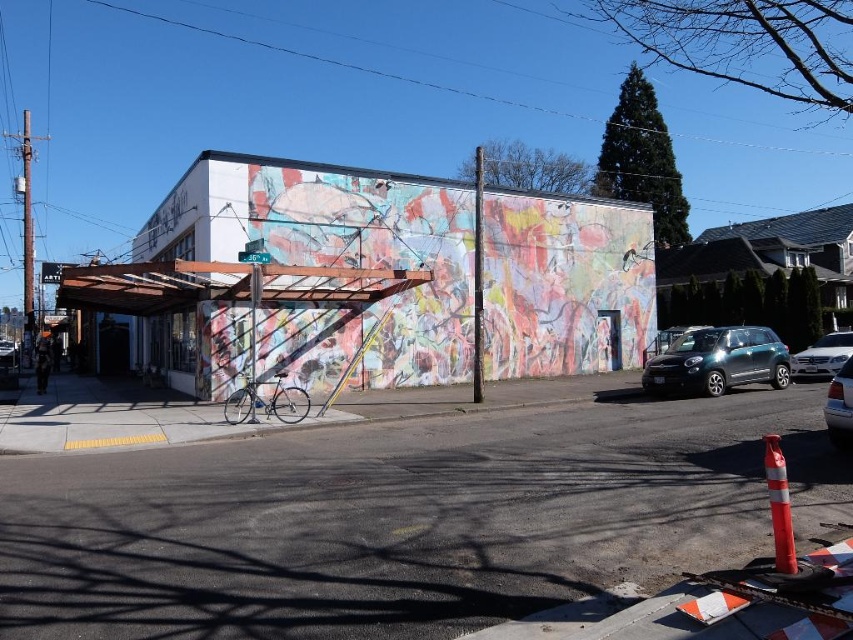
Question: Which object is the farthest from the shiny dark gray car at right?

Choices:
 (A) satin silver sedan at right
 (B) metallic silver sedan at right

Answer: (B)

Question: Considering the real-world distances, which object is farthest from the satin silver sedan at right?

Choices:
 (A) shiny dark gray car at right
 (B) metallic silver sedan at right

Answer: (B)

Question: Does shiny dark gray car at right appear over metallic silver sedan at right?

Choices:
 (A) no
 (B) yes

Answer: (B)

Question: Can you confirm if shiny dark gray car at right is positioned below metallic silver sedan at right?

Choices:
 (A) yes
 (B) no

Answer: (B)

Question: Is shiny dark gray car at right below metallic silver sedan at right?

Choices:
 (A) yes
 (B) no

Answer: (B)

Question: Which of the following is the farthest from the observer?

Choices:
 (A) (792, 364)
 (B) (697, 337)
 (C) (848, 436)

Answer: (A)